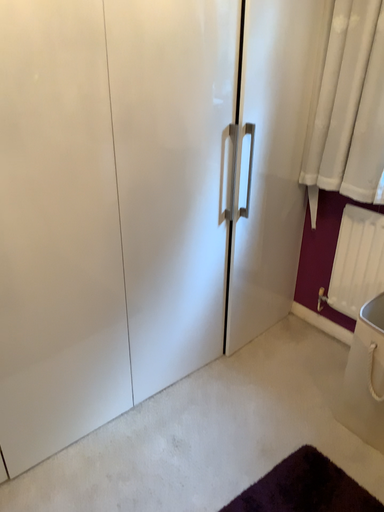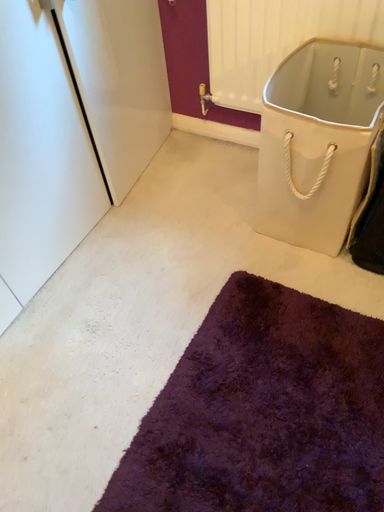
Question: Which way did the camera rotate in the video?

Choices:
 (A) rotated left
 (B) rotated right

Answer: (B)